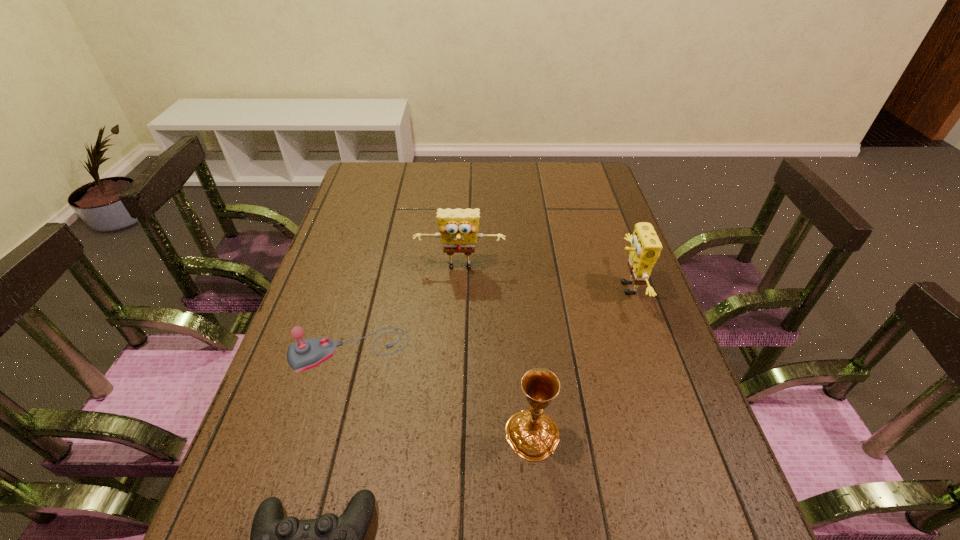
Locate an element on the screen. The image size is (960, 540). free space located 0.060m on the front of the fourth tallest object is located at coordinates click(336, 399).

Where is `object at the left edge`? object at the left edge is located at coordinates (302, 355).

Where is `object that is positioned at the right edge`? object that is positioned at the right edge is located at coordinates (645, 249).

The width and height of the screenshot is (960, 540). In the image, there is a desktop. Find the location of `vacant space at the far edge`. vacant space at the far edge is located at coordinates (430, 169).

Identify the location of free space at the left edge of the desktop. (343, 217).

Find the location of a particular element. Image resolution: width=960 pixels, height=540 pixels. vacant space at the right edge is located at coordinates (612, 310).

Identify the location of vacant position at the far right corner of the desktop. The height and width of the screenshot is (540, 960). (586, 163).

Locate an element on the screen. This screenshot has height=540, width=960. vacant space at the near right corner of the desktop is located at coordinates (742, 538).

At what (x,y) coordinates should I click in order to perform the action: click on unoccupied area between the left sponge and the chalice. Please return your answer as a coordinate pair (x, y). The image size is (960, 540). Looking at the image, I should click on (496, 352).

The height and width of the screenshot is (540, 960). Identify the location of blank region between the left sponge and the chalice. (496, 352).